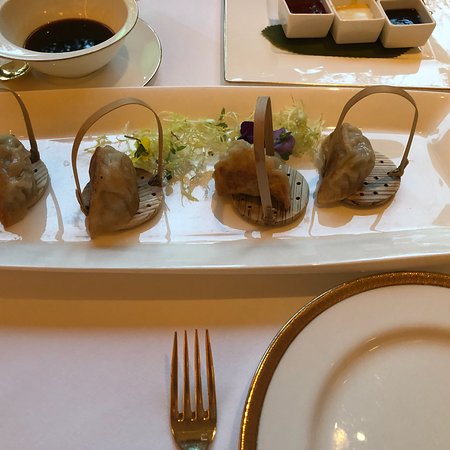
What are the coordinates of `fork` in the screenshot? It's located at (190, 430).